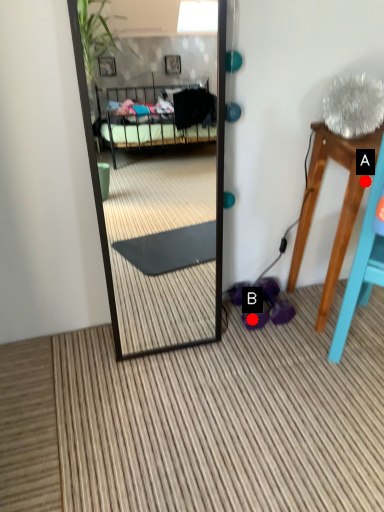
Question: Two points are circled on the image, labeled by A and B beside each circle. Which of the following is the closest to the observer?

Choices:
 (A) A is closer
 (B) B is closer

Answer: (A)